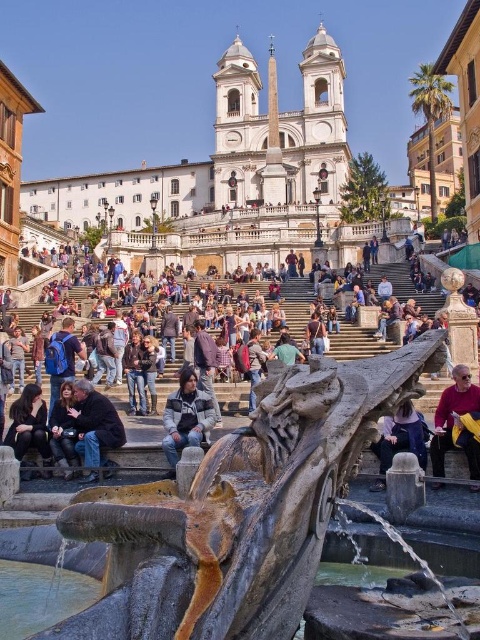
Question: Which of the following is the farthest from the observer?

Choices:
 (A) (85, 412)
 (B) (215, 419)
 (C) (24, 445)
 (D) (468, 406)

Answer: (B)

Question: Does matte stone crowd at center have a larger size compared to dark brown leather jacket at lower left?

Choices:
 (A) no
 (B) yes

Answer: (B)

Question: Which of the following is the closest to the observer?

Choices:
 (A) (457, 278)
 (B) (196, 481)
 (C) (467, 378)

Answer: (B)

Question: Does rustic stone fountain at center have a larger size compared to dark gray jacket at center?

Choices:
 (A) yes
 (B) no

Answer: (A)

Question: Estimate the real-world distances between objects in this image. Which object is closer to the dark brown leather jacket at lower right?

Choices:
 (A) dark brown leather jacket at lower left
 (B) matte stone crowd at center
 (C) dark gray jacket at center
 (D) rustic stone fountain at center

Answer: (C)

Question: Is dark gray jacket at center bigger than dark brown leather jacket at lower left?

Choices:
 (A) yes
 (B) no

Answer: (A)